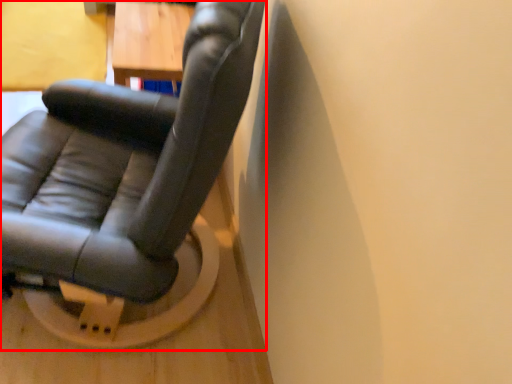
Question: From the image's perspective, where is chair (annotated by the red box) located relative to table?

Choices:
 (A) below
 (B) above

Answer: (A)